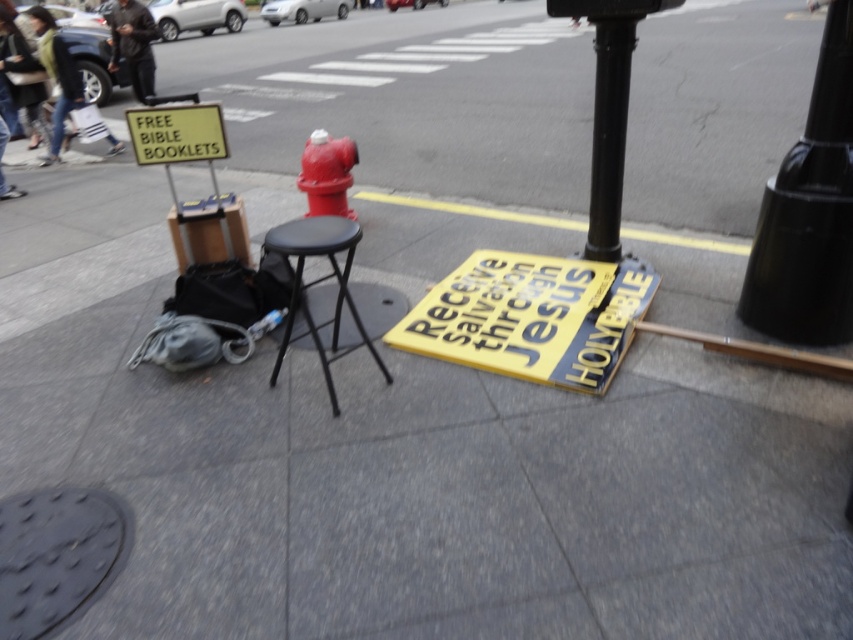
Between black glossy pole at upper right and glossy metal fire hydrant at center, which one appears on the right side from the viewer's perspective?

Positioned to the right is black glossy pole at upper right.

Who is positioned more to the left, black glossy pole at upper right or glossy metal fire hydrant at center?

From the viewer's perspective, glossy metal fire hydrant at center appears more on the left side.

Who is more distant from viewer, (x=822, y=160) or (x=338, y=150)?

The point (x=338, y=150) is behind.

At what (x,y) coordinates should I click in order to perform the action: click on black glossy pole at upper right. Please return your answer as a coordinate pair (x, y). This screenshot has width=853, height=640. Looking at the image, I should click on (809, 212).

From the picture: Does black rubber manhole cover at lower left have a smaller size compared to dark gray jacket at upper left?

Indeed, black rubber manhole cover at lower left has a smaller size compared to dark gray jacket at upper left.

Between point (0, 529) and point (126, 38), which one is positioned in front?

Point (0, 529) is more forward.

Locate an element on the screen. black rubber manhole cover at lower left is located at coordinates (57, 556).

You are a GUI agent. You are given a task and a screenshot of the screen. Output one action in this format:
    pyautogui.click(x=<x>, y=<y>)
    Task: Click on the black rubber manhole cover at lower left
    This screenshot has height=640, width=853.
    Given the screenshot: What is the action you would take?
    pyautogui.click(x=57, y=556)

Can you confirm if black glossy pole at upper right is positioned above dark gray jacket at upper left?

Actually, black glossy pole at upper right is below dark gray jacket at upper left.

Is black glossy pole at upper right positioned before dark gray jacket at upper left?

Yes, it is in front of dark gray jacket at upper left.

At what (x,y) coordinates should I click in order to perform the action: click on black glossy pole at upper right. Please return your answer as a coordinate pair (x, y). Looking at the image, I should click on (809, 212).

Identify the location of black glossy pole at upper right. (809, 212).